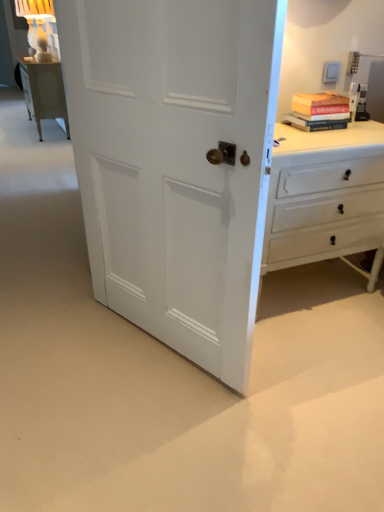
Question: Which is correct: hardcover book at upper right is inside white painted wood chest of drawers at right, or outside of it?

Choices:
 (A) inside
 (B) outside

Answer: (B)

Question: From a real-world perspective, relative to white painted wood chest of drawers at right, is hardcover book at upper right vertically above or below?

Choices:
 (A) above
 (B) below

Answer: (A)

Question: Which is farther from the white painted wood door at center?

Choices:
 (A) hardcover book at upper right
 (B) white painted wood chest of drawers at right

Answer: (A)

Question: Estimate the real-world distances between objects in this image. Which object is farther from the hardcover book at upper right?

Choices:
 (A) white painted wood door at center
 (B) white painted wood chest of drawers at right

Answer: (A)